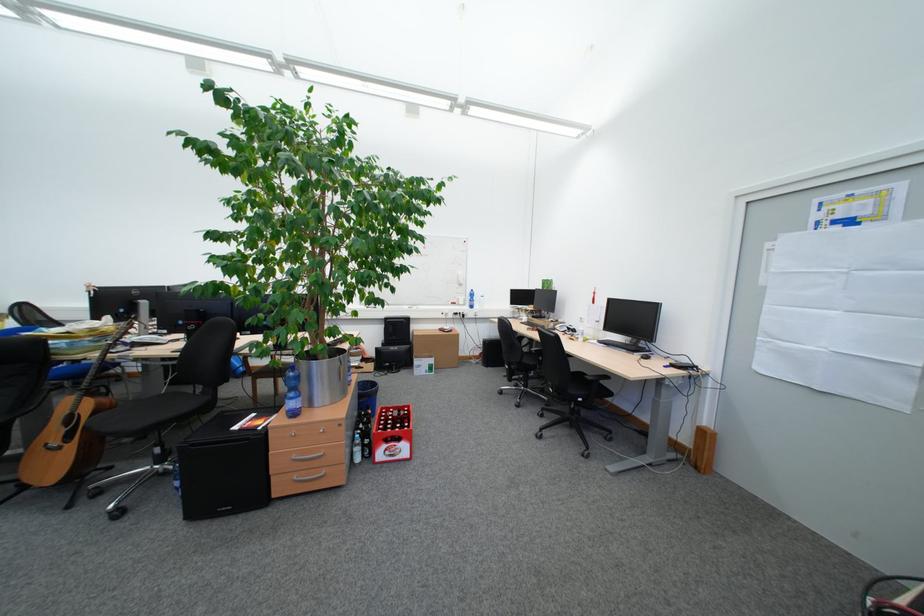
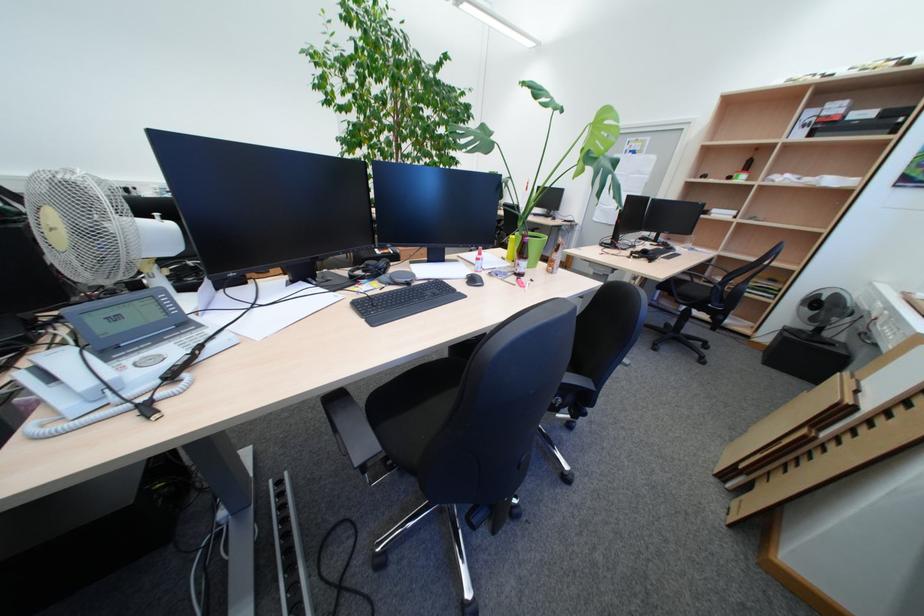
Question: I am providing you with two images of the same scene from different viewpoints. After the viewpoint changes to image2, which objects are now occluded?

Choices:
 (A) red bottle crate
 (B) red bottle
 (C) green glass bottle
 (D) green dry-erase marker

Answer: (A)